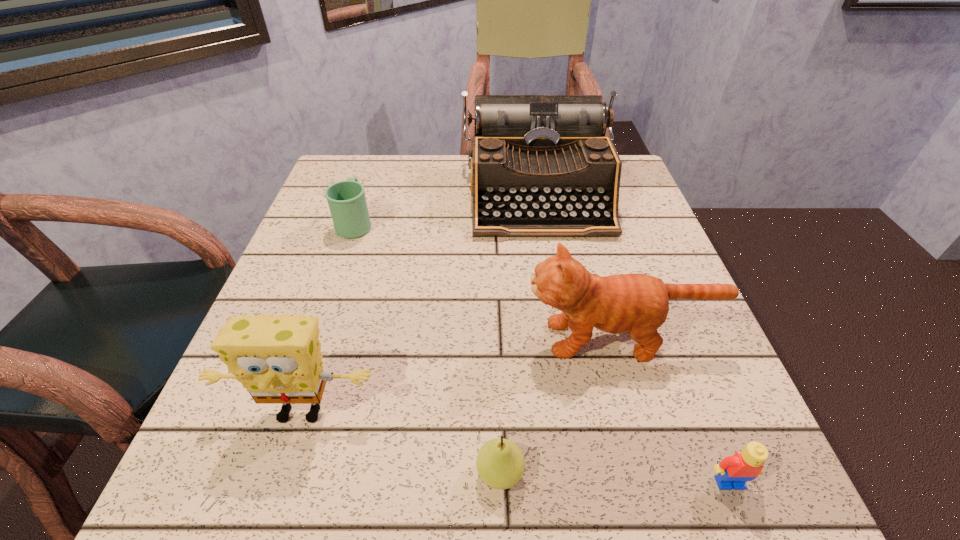
Identify the location of blank region between the pear and the typewriter. The width and height of the screenshot is (960, 540). (519, 334).

I want to click on free space between the mug and the pear, so click(x=428, y=348).

Where is `unoccupied position between the typewriter and the mug`? unoccupied position between the typewriter and the mug is located at coordinates (447, 209).

I want to click on vacant region between the Lego and the pear, so click(614, 477).

Image resolution: width=960 pixels, height=540 pixels. I want to click on empty location between the Lego and the third farthest object, so click(x=674, y=410).

Identify the location of unoccupied position between the Lego and the cat. The height and width of the screenshot is (540, 960). (674, 410).

Where is `free space between the fourth farthest object and the typewriter`? free space between the fourth farthest object and the typewriter is located at coordinates (420, 303).

Identify the location of blank region between the pear and the typewriter. This screenshot has height=540, width=960. (519, 334).

Where is `free space between the typewriter and the pear`? free space between the typewriter and the pear is located at coordinates (519, 334).

You are a GUI agent. You are given a task and a screenshot of the screen. Output one action in this format:
    pyautogui.click(x=<x>, y=<y>)
    Task: Click on the object that is the fourth nearest to the typewriter
    
    Given the screenshot: What is the action you would take?
    pyautogui.click(x=500, y=463)